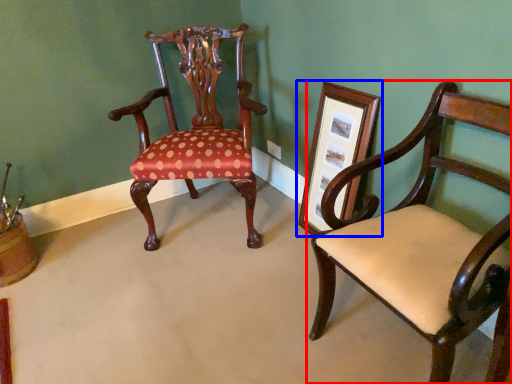
Question: Which object appears farthest to the camera in this image, chair (highlighted by a red box) or picture frame (highlighted by a blue box)?

Choices:
 (A) chair
 (B) picture frame

Answer: (B)